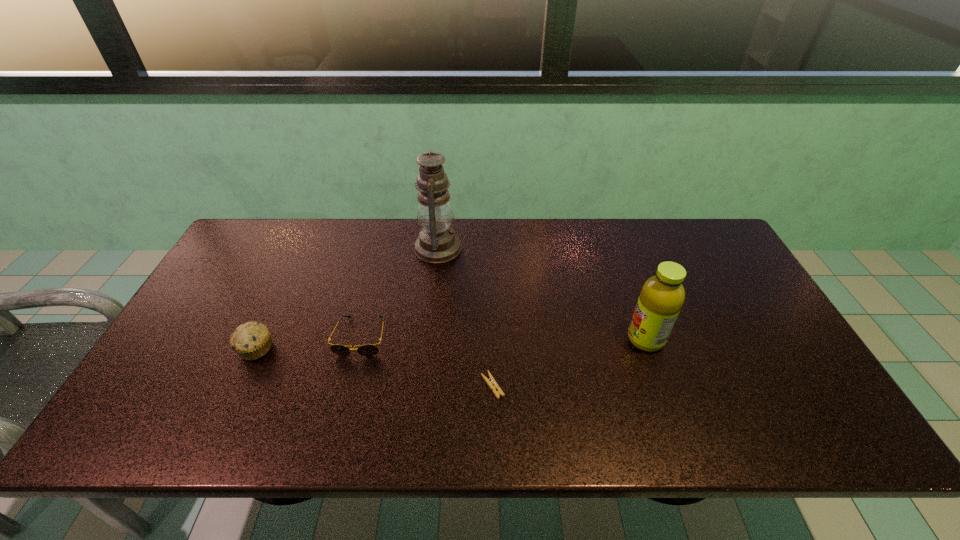
Identify the location of vacant point located between the rightmost object and the farthest object. (541, 294).

The height and width of the screenshot is (540, 960). Identify the location of unoccupied area between the third shortest object and the tallest object. (347, 299).

Where is `unoccupied position between the fourth object from left to right and the muffin`? The image size is (960, 540). unoccupied position between the fourth object from left to right and the muffin is located at coordinates (374, 367).

Locate an element on the screen. The height and width of the screenshot is (540, 960). object that stands as the second closest to the rightmost object is located at coordinates (437, 243).

Choose which object is the third nearest neighbor to the third object from right to left. Please provide its 2D coordinates. Your answer should be formatted as a tuple, i.e. [(x, y)], where the tuple contains the x and y coordinates of a point satisfying the conditions above.

[(252, 340)]

Identify the location of free region that satisfies the following two spatial constraints: 1. on the front label of the rightmost object; 2. on the front side of the muffin. (649, 349).

Locate an element on the screen. This screenshot has width=960, height=540. vacant space that satisfies the following two spatial constraints: 1. on the front label of the fruit juice; 2. on the front side of the nearest object is located at coordinates (661, 386).